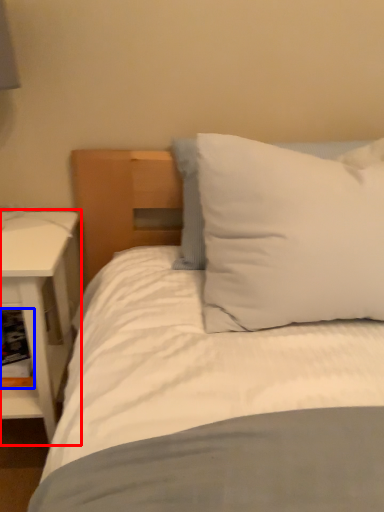
Question: Among these objects, which one is nearest to the camera, nightstand (highlighted by a red box) or shelf (highlighted by a blue box)?

Choices:
 (A) nightstand
 (B) shelf

Answer: (A)